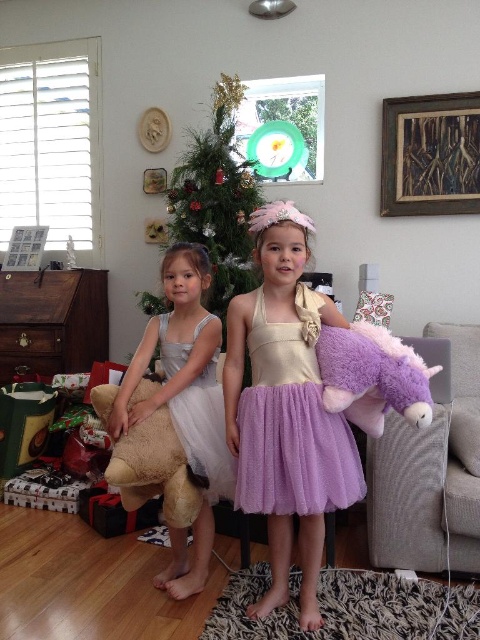
You are standing in the living room and want to place a new decoration at the exact center of the room. The green textured christmas tree at center is currently at point 0.314, 0.452. Is the tree already at the center of the room?

The green textured christmas tree at center is positioned at point (216, 200), which indicates it is already at the center of the room.

Based on the photo, you are a parent trying to locate your child who is playing hide and seek in the living room. You see the green textured christmas tree at center and the purple plush unicorn at right. Which object is closer to you if you are standing at the entrance of the living room?

The green textured christmas tree at center is closer to you because the purple plush unicorn at right is behind it.

You are a parent trying to ensure your child stays within a safe distance from the Christmas tree. The lavender tulle dress at center is where your child is standing. Can the child stay at that spot without being too close to the green textured christmas tree at center?

The distance between the lavender tulle dress at center and the green textured christmas tree at center is 4.13 feet. Since this distance is considered safe for a child to be near a Christmas tree, the child can remain at that spot.